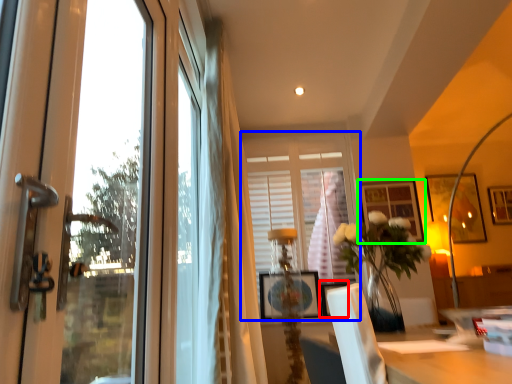
Question: Estimate the real-world distances between objects in this image. Which object is farther from picture frame (highlighted by a red box), window (highlighted by a blue box) or picture frame (highlighted by a green box)?

Choices:
 (A) window
 (B) picture frame

Answer: (B)